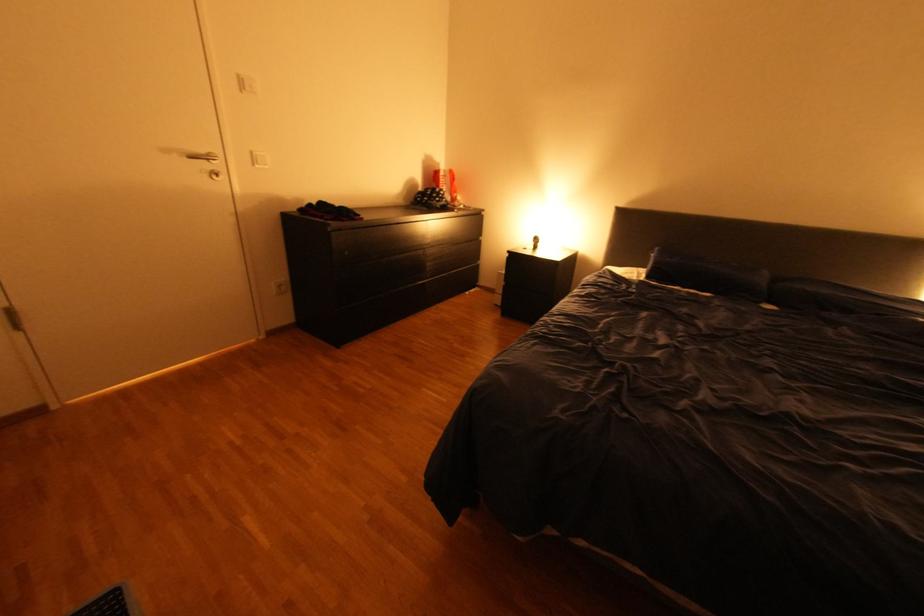
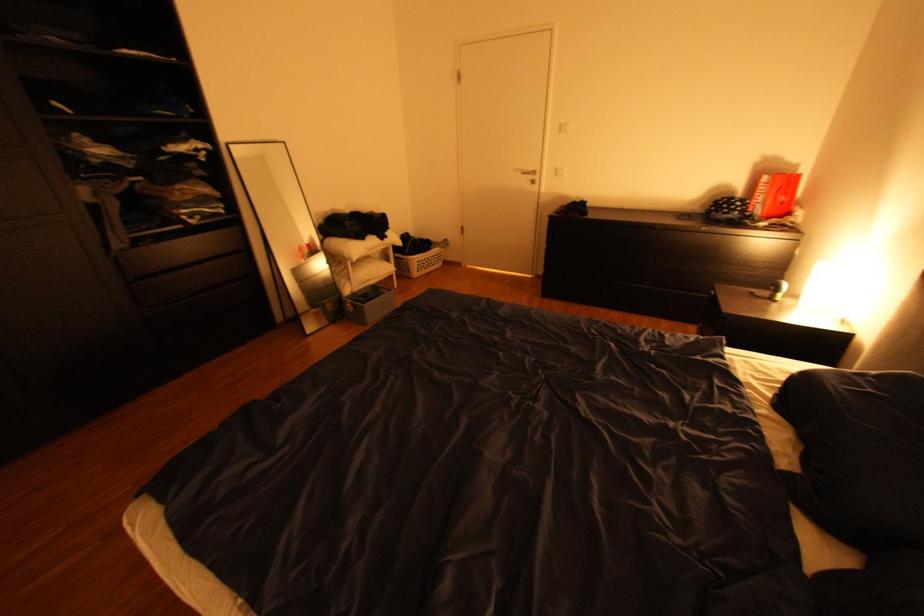
In the second image, find the point that corresponds to (273,336) in the first image.

(543, 276)